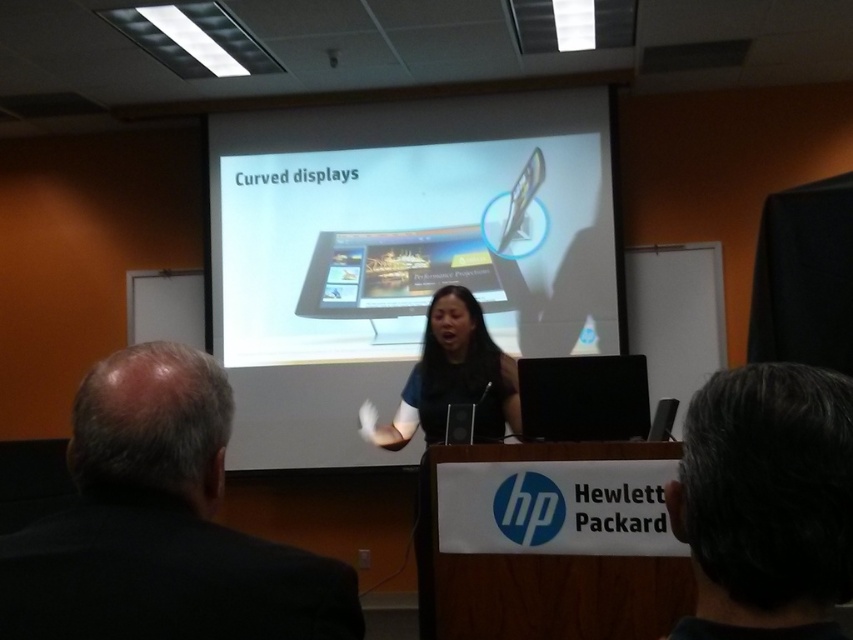
Question: Does gray hair at upper right appear on the right side of black fabric shirt at center?

Choices:
 (A) no
 (B) yes

Answer: (B)

Question: Which of these objects is positioned farthest from the black fabric shirt at center?

Choices:
 (A) dark gray suit at left
 (B) gray hair at upper right

Answer: (B)

Question: Which point appears farthest from the camera in this image?

Choices:
 (A) (439, 342)
 (B) (540, 330)
 (C) (498, 352)

Answer: (B)

Question: Does gray hair at upper right have a larger size compared to black fabric dress at center?

Choices:
 (A) no
 (B) yes

Answer: (A)

Question: Based on their relative distances, which object is farther from the dark gray suit at left?

Choices:
 (A) gray hair at upper right
 (B) black fabric dress at center
 (C) black fabric shirt at center
 (D) matte black laptop at center

Answer: (C)

Question: Is black fabric shirt at center above matte black laptop at center?

Choices:
 (A) yes
 (B) no

Answer: (A)